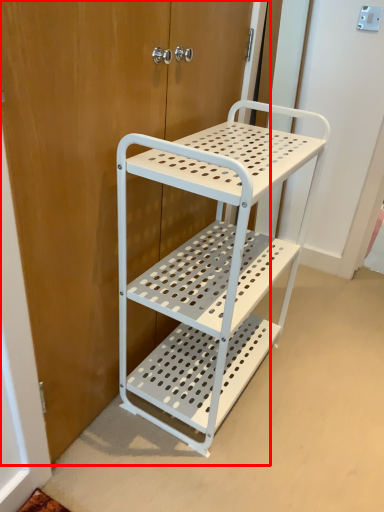
Question: From the image's perspective, what is the correct spatial relationship of door (annotated by the red box) in relation to furniture?

Choices:
 (A) below
 (B) above

Answer: (B)